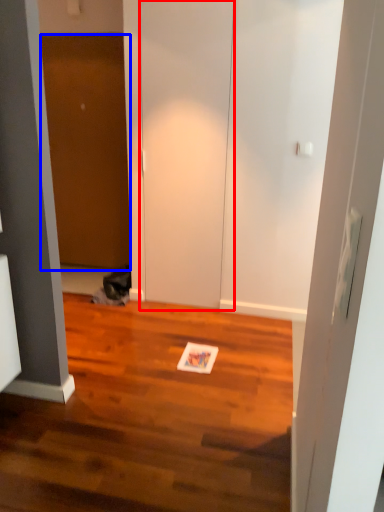
Question: Among these objects, which one is farthest to the camera, door (highlighted by a red box) or door (highlighted by a blue box)?

Choices:
 (A) door
 (B) door

Answer: (B)